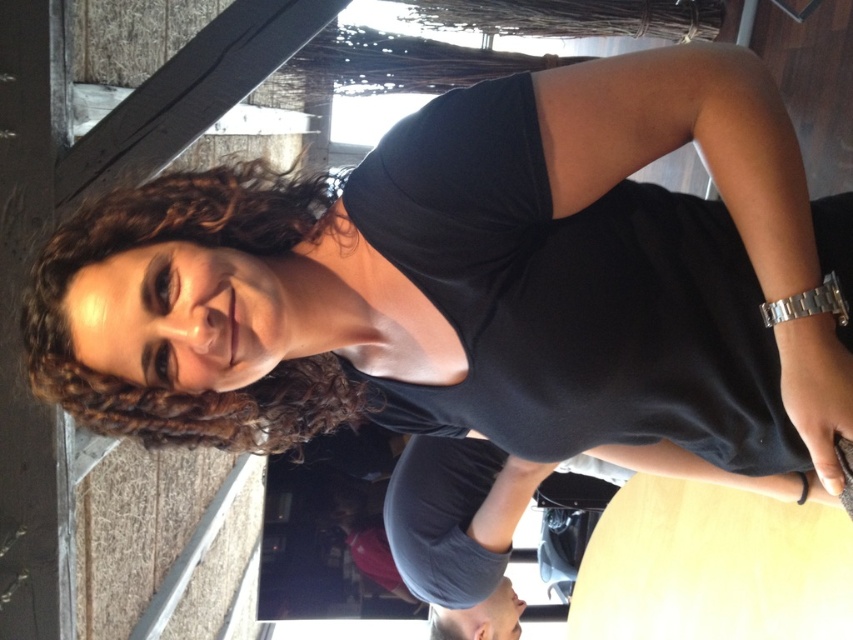
Question: Can you confirm if black matte dress at center is smaller than curly brown hair at upper left?

Choices:
 (A) yes
 (B) no

Answer: (B)

Question: Is black matte dress at center above curly brown hair at upper left?

Choices:
 (A) yes
 (B) no

Answer: (A)

Question: Is black matte dress at center closer to camera compared to curly brown hair at upper left?

Choices:
 (A) yes
 (B) no

Answer: (A)

Question: Which object is farther from the camera taking this photo?

Choices:
 (A) curly brown hair at upper left
 (B) black matte dress at center

Answer: (A)